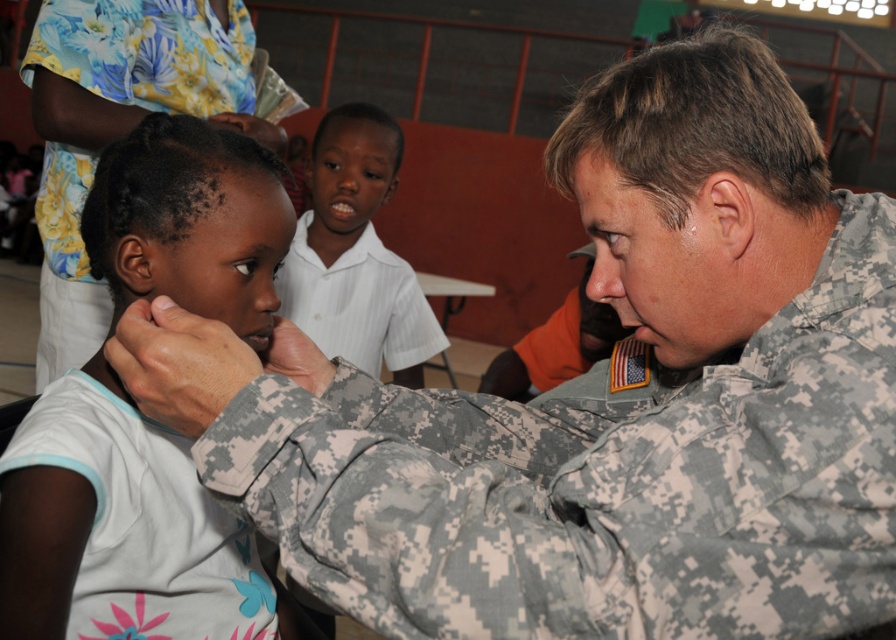
You are designing a costume for a play and need to choose between the camouflage fabric at center and the white striped shirt at center. Which fabric should you select if you want the material to be thicker?

The white striped shirt at center is thicker than the camouflage fabric at center, so you should choose the white striped shirt at center for a thicker material.

Looking at this image, you are a photographer setting up for a group photo in this indoor scene. You need to position two markers at the coordinates point (x=168, y=602) and point (x=386, y=310). Which marker should you place first if you want to start from the closest point to the camera and move towards the farthest?

You should place the marker at point (x=168, y=602) first because it is closer to the camera than point (x=386, y=310).